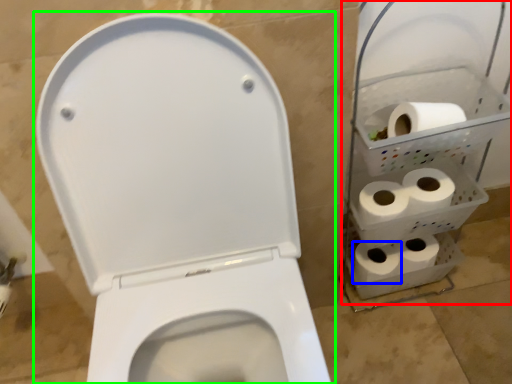
Question: Estimate the real-world distances between objects in this image. Which object is closer to shelf (highlighted by a red box), toilet paper (highlighted by a blue box) or toilet paper (highlighted by a green box)?

Choices:
 (A) toilet paper
 (B) toilet paper

Answer: (A)